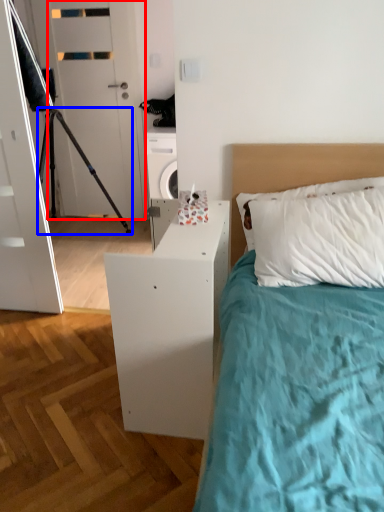
Question: Among these objects, which one is nearest to the camera, door (highlighted by a red box) or tripod (highlighted by a blue box)?

Choices:
 (A) door
 (B) tripod

Answer: (B)